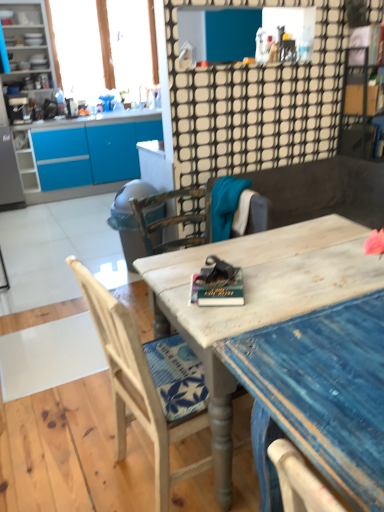
What do you see at coordinates (257, 300) in the screenshot?
I see `distressed wood desk at center` at bounding box center [257, 300].

Identify the location of distressed wood desk at center. The height and width of the screenshot is (512, 384). (257, 300).

The height and width of the screenshot is (512, 384). What do you see at coordinates (29, 48) in the screenshot?
I see `matte white cabinet at upper left` at bounding box center [29, 48].

Find the location of a particular element. The height and width of the screenshot is (512, 384). wooden chair at center, the 2th chair positioned from the back is located at coordinates (136, 385).

You are a GUI agent. You are given a task and a screenshot of the screen. Output one action in this format:
    pyautogui.click(x=<x>, y=<y>)
    Task: Click on the distressed wood desk at center
    Image resolution: width=384 pixels, height=512 pixels.
    Given the screenshot: What is the action you would take?
    [x=257, y=300]

Would you say distressed wood desk at center contains translucent fabric at upper left?

That's incorrect, translucent fabric at upper left is not inside distressed wood desk at center.

Who is taller, distressed wood desk at center or translucent fabric at upper left?

With more height is translucent fabric at upper left.

From a real-world perspective, is distressed wood desk at center positioned under translucent fabric at upper left based on gravity?

Indeed, from a real-world perspective, distressed wood desk at center is positioned beneath translucent fabric at upper left.

Could matte white cabinet at upper left be considered to be inside wooden chair at center?

No, wooden chair at center does not contain matte white cabinet at upper left.

Is wooden chair at center not near matte white cabinet at upper left?

Yes, wooden chair at center is far from matte white cabinet at upper left.

How different are the orientations of wooden chair at center and matte white cabinet at upper left in degrees?

There is a 1.17-degree angle between the facing directions of wooden chair at center and matte white cabinet at upper left.

Would you say wooden chair at center is to the left or to the right of matte white cabinet at upper left in the picture?

Clearly, wooden chair at center is on the right of matte white cabinet at upper left in the image.

Is matte white cabinet at upper left completely or partially outside of translucent fabric at upper left?

Yes.

Which object is positioned more to the left, matte white cabinet at upper left or translucent fabric at upper left?

From the viewer's perspective, matte white cabinet at upper left appears more on the left side.

From the image's perspective, which is above, matte white cabinet at upper left or translucent fabric at upper left?

translucent fabric at upper left appears higher in the image.

Relative to matte white cabinet at upper left, is matte gray trash can at center-left in front or behind?

Visually, matte gray trash can at center-left is located in front of matte white cabinet at upper left.

Which of these two, matte gray trash can at center-left or matte white cabinet at upper left, is bigger?

matte white cabinet at upper left.

From the image's perspective, is matte gray trash can at center-left under matte white cabinet at upper left?

Indeed, from the image's perspective, matte gray trash can at center-left is shown beneath matte white cabinet at upper left.

Is wooden chair at center, marked as the 1th chair in a front-to-back arrangement, far away from wooden chair at center, the 1th chair from the back?

Yes, wooden chair at center, marked as the 1th chair in a front-to-back arrangement, and wooden chair at center, the 1th chair from the back, are located far from each other.

Considering the sizes of wooden chair at center, marked as the 1th chair in a front-to-back arrangement, and wooden chair at center, acting as the 2th chair starting from the front, in the image, is wooden chair at center, marked as the 1th chair in a front-to-back arrangement, taller or shorter than wooden chair at center, acting as the 2th chair starting from the front,?

Considering their sizes, wooden chair at center, marked as the 1th chair in a front-to-back arrangement, has more height than wooden chair at center, acting as the 2th chair starting from the front.

Is wooden chair at center, the 2th chair positioned from the back, outside of wooden chair at center, acting as the 2th chair starting from the front?

Indeed, wooden chair at center, the 2th chair positioned from the back, is completely outside wooden chair at center, acting as the 2th chair starting from the front.

In the image, is wooden chair at center, marked as the 1th chair in a front-to-back arrangement, on the left side or the right side of wooden chair at center, acting as the 2th chair starting from the front?

In the image, wooden chair at center, marked as the 1th chair in a front-to-back arrangement, appears on the left side of wooden chair at center, acting as the 2th chair starting from the front.

From a real-world perspective, is distressed wood desk at center under wooden chair at center, the 2th chair positioned from the back?

Yes, from a real-world perspective, distressed wood desk at center is below wooden chair at center, the 2th chair positioned from the back.

Are distressed wood desk at center and wooden chair at center, marked as the 1th chair in a front-to-back arrangement, far apart?

No, distressed wood desk at center is not far from wooden chair at center, marked as the 1th chair in a front-to-back arrangement.

Considering the positions of point (321, 222) and point (104, 302), is point (321, 222) closer or farther from the camera than point (104, 302)?

Point (321, 222) appears to be farther away from the viewer than point (104, 302).

Does point (186, 419) lie behind point (172, 291)?

No, it is in front of (172, 291).

Between wooden chair at center, the 2th chair positioned from the back, and distressed wood desk at center, which one is positioned in front?

wooden chair at center, the 2th chair positioned from the back, is more forward.

Locate an element on the screen. desk behind the wooden chair at center, the 2th chair positioned from the back is located at coordinates (257, 300).

Does wooden chair at center, marked as the 1th chair in a front-to-back arrangement, have a lesser width compared to distressed wood desk at center?

Yes.

Identify the location of desk on the right of translucent fabric at upper left. This screenshot has width=384, height=512. (257, 300).

You are a GUI agent. You are given a task and a screenshot of the screen. Output one action in this format:
    pyautogui.click(x=<x>, y=<y>)
    Task: Click on the cabinetry above the wooden chair at center (from the image's perspective)
    
    Given the screenshot: What is the action you would take?
    pyautogui.click(x=29, y=48)

Considering their positions, is matte white cabinet at upper left positioned further to wooden chair at center, the 1th chair from the back, than wooden chair at center, the 2th chair positioned from the back?

matte white cabinet at upper left lies further to wooden chair at center, the 1th chair from the back, than the other object.

Based on the photo, which object lies further to the anchor point wooden chair at center, marked as the 1th chair in a front-to-back arrangement, distressed wood desk at center or wooden chair at center?

wooden chair at center lies further to wooden chair at center, marked as the 1th chair in a front-to-back arrangement, than the other object.

Estimate the real-world distances between objects in this image. Which object is closer to distressed wood desk at center, matte gray trash can at center-left or wooden chair at center, the 2th chair positioned from the back?

Based on the image, wooden chair at center, the 2th chair positioned from the back, appears to be nearer to distressed wood desk at center.

From the image, which object appears to be nearer to translucent fabric at upper left, distressed wood desk at center or wooden chair at center?

wooden chair at center is positioned closer to the anchor translucent fabric at upper left.

Looking at the image, which one is located further to translucent fabric at upper left, wooden chair at center, acting as the 2th chair starting from the front, or wooden chair at center?

wooden chair at center, acting as the 2th chair starting from the front, is further to translucent fabric at upper left.

Looking at this image, estimate the real-world distances between objects in this image. Which object is further from distressed wood desk at center, wooden chair at center or matte white cabinet at upper left?

The object further to distressed wood desk at center is matte white cabinet at upper left.

When comparing their distances from matte gray trash can at center-left, does wooden chair at center, the 1th chair from the back, or wooden chair at center, the 2th chair positioned from the back, seem closer?

wooden chair at center, the 1th chair from the back, is positioned closer to the anchor matte gray trash can at center-left.

Looking at this image, considering their positions, is matte gray trash can at center-left positioned closer to matte white cabinet at upper left than wooden chair at center, the 1th chair from the back?

matte gray trash can at center-left.

Find the location of a particular element. This screenshot has height=512, width=384. desk between wooden chair at center, the 2th chair positioned from the back, and translucent fabric at upper left in the front-back direction is located at coordinates (257, 300).

At what (x,y) coordinates should I click in order to perform the action: click on desk located between wooden chair at center, marked as the 1th chair in a front-to-back arrangement, and wooden chair at center, acting as the 2th chair starting from the front, in the depth direction. Please return your answer as a coordinate pair (x, y). Looking at the image, I should click on (257, 300).

Find the location of a particular element. The image size is (384, 512). trash bin/can between matte white cabinet at upper left and wooden chair at center, the 1th chair from the back, in the vertical direction is located at coordinates (129, 219).

At what (x,y) coordinates should I click in order to perform the action: click on trash bin/can between distressed wood desk at center and translucent fabric at upper left in the front-back direction. Please return your answer as a coordinate pair (x, y). The image size is (384, 512). Looking at the image, I should click on (129, 219).